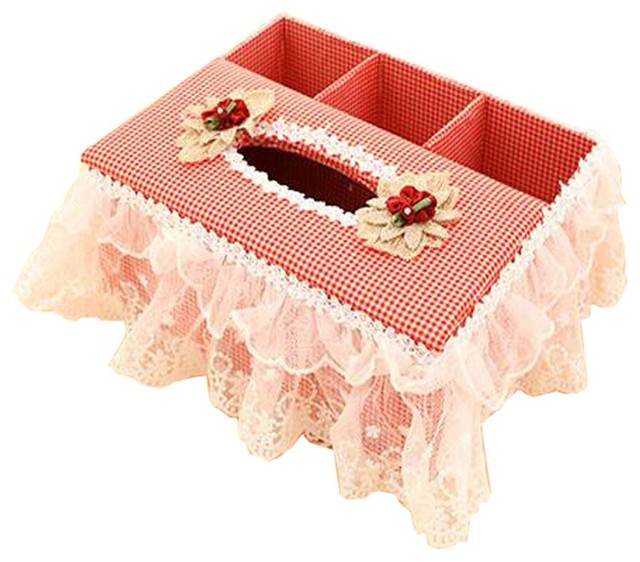
Where is `lace`? lace is located at coordinates (260, 191).